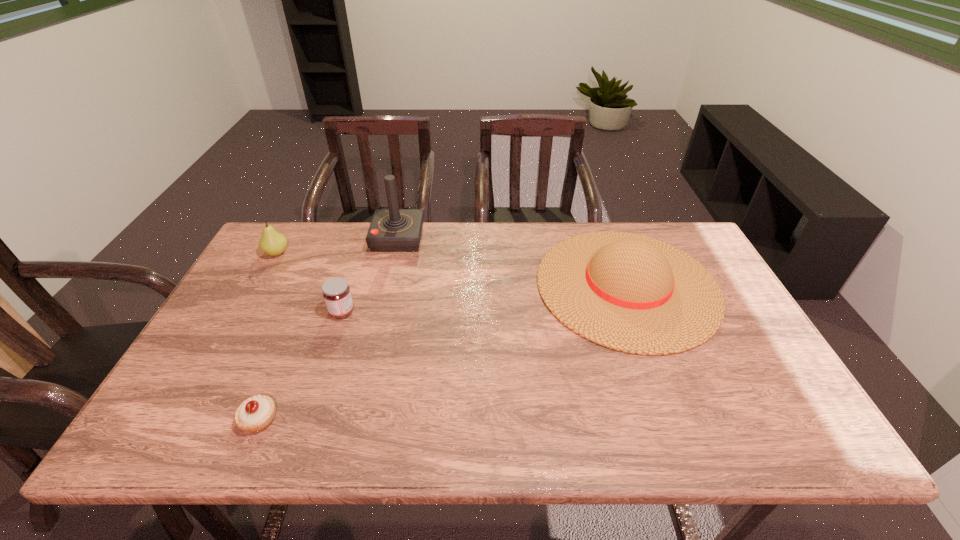
Identify the location of the tallest object. The image size is (960, 540). (391, 230).

Identify the location of bonnet. (631, 293).

You are a GUI agent. You are given a task and a screenshot of the screen. Output one action in this format:
    pyautogui.click(x=<x>, y=<y>)
    Task: Click on the pear
    
    Given the screenshot: What is the action you would take?
    pyautogui.click(x=273, y=243)

Where is `the third shortest object`? the third shortest object is located at coordinates (273, 243).

Find the location of a particular element. This screenshot has height=540, width=960. the fourth tallest object is located at coordinates tap(336, 293).

Locate an element on the screen. the nearest object is located at coordinates (254, 414).

Locate an element on the screen. the shortest object is located at coordinates (254, 414).

You are a GUI agent. You are given a task and a screenshot of the screen. Output one action in this format:
    pyautogui.click(x=<x>, y=<y>)
    Task: Click on the vacant point located on the rectangular base of the joystick
    The height and width of the screenshot is (540, 960).
    Given the screenshot: What is the action you would take?
    pyautogui.click(x=459, y=238)

Identify the location of vacant space situated on the front of the bonnet. This screenshot has width=960, height=540. click(667, 394).

The height and width of the screenshot is (540, 960). I want to click on blank space located on the back of the third tallest object, so click(x=291, y=228).